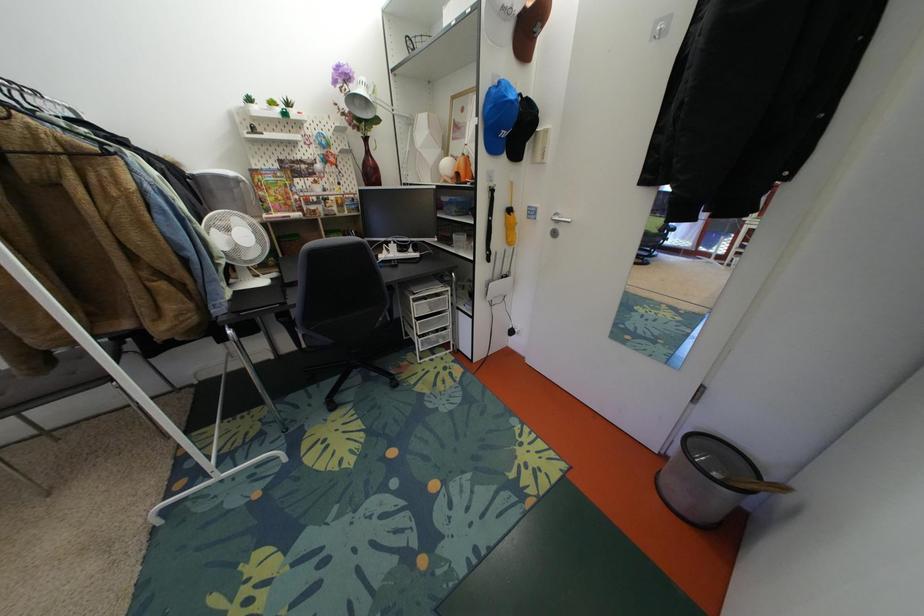
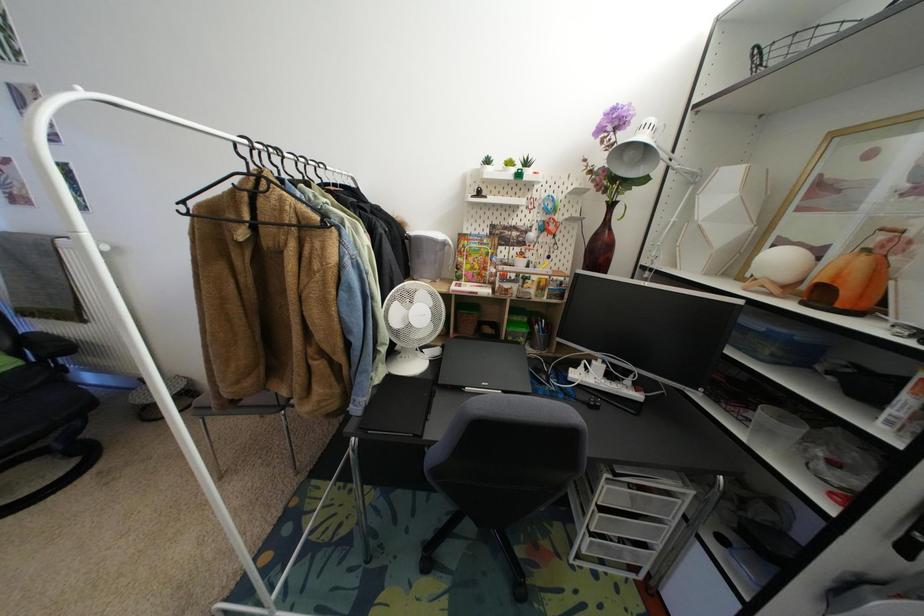
Question: The camera is either moving clockwise (left) or counter-clockwise (right) around the object. The first image is from the beginning of the video and the second image is from the end. Is the camera moving left or right when shooting the video?

Choices:
 (A) Left
 (B) Right

Answer: (B)